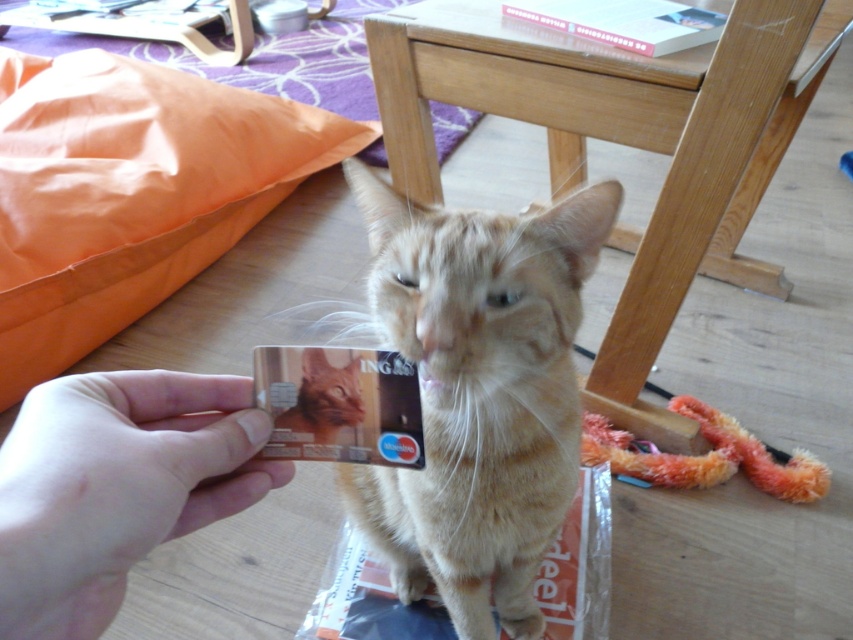
You are a delivery robot and need to place a package on the wooden stool at center. According to the scene description, where exactly is the wooden stool located?

The wooden stool at center is located at point (622, 144).

You are a delivery robot that needs to place a small package on the wooden stool at center without disturbing the golden fur cat at center. Can you fit the package between them?

The wooden stool at center might be wider than golden fur cat at center, so there might be enough space to place the package between them without disturbing the cat.

You are trying to place a small decorative plate between the wooden stool at center and the smooth skin hand at lower left. Based on their widths, can the plate fit between them?

The wooden stool at center might be wider than smooth skin hand at lower left, so the plate may not fit between them if the stool is wider. However, since the exact width difference isn